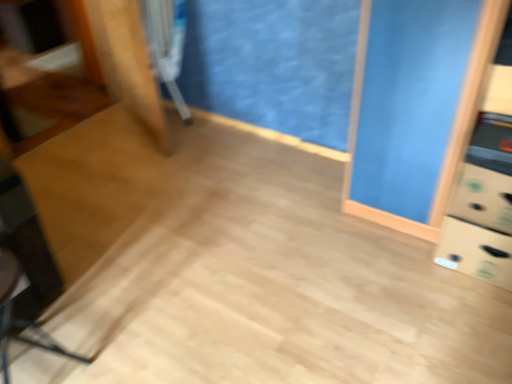
Where is `free space underneath black plastic swivel chair at lower left, which appears as the 2th swivel chair when viewed from the back (from a real-world perspective)`? This screenshot has height=384, width=512. free space underneath black plastic swivel chair at lower left, which appears as the 2th swivel chair when viewed from the back (from a real-world perspective) is located at coordinates (44, 365).